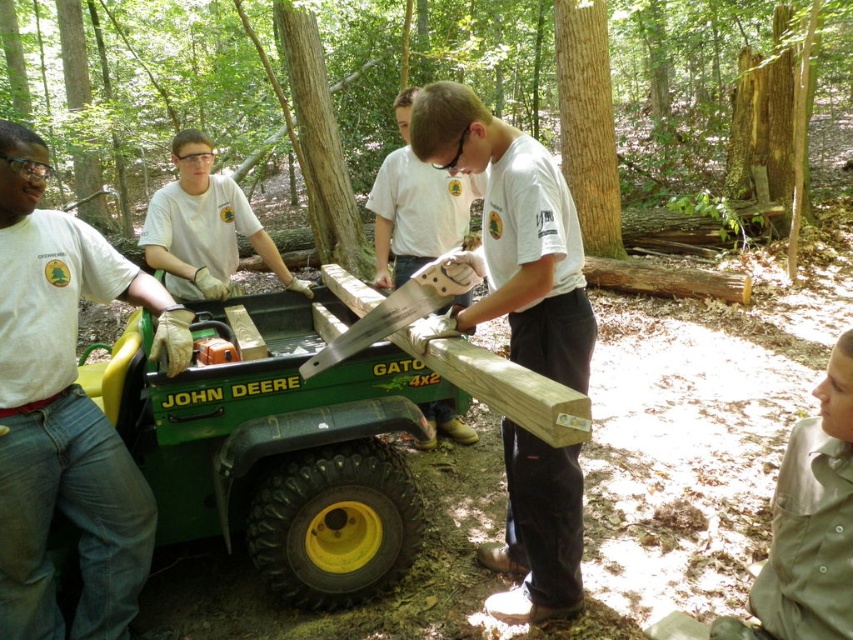
Is natural wood log at center smaller than denim jeans at left?

No.

Who is more distant from viewer, (64,93) or (0,474)?

The point (64,93) is more distant.

Does point (73, 145) lie behind point (4, 557)?

Yes, it is behind point (4, 557).

This screenshot has width=853, height=640. I want to click on natural wood log at center, so click(138, 84).

What do you see at coordinates (138, 84) in the screenshot?
I see `natural wood log at center` at bounding box center [138, 84].

Is natural wood log at center smaller than matte white saw at center?

No, natural wood log at center is not smaller than matte white saw at center.

Describe the element at coordinates (138, 84) in the screenshot. I see `natural wood log at center` at that location.

You are a GUI agent. You are given a task and a screenshot of the screen. Output one action in this format:
    pyautogui.click(x=<x>, y=<y>)
    Task: Click on the natural wood log at center
    The image size is (853, 640).
    Given the screenshot: What is the action you would take?
    pyautogui.click(x=138, y=84)

Does point (199, 275) lie in front of point (440, 205)?

Yes, point (199, 275) is closer to viewer.

How distant is white matte shirt at upper center from matte white saw at center?

A distance of 33.23 inches exists between white matte shirt at upper center and matte white saw at center.

The width and height of the screenshot is (853, 640). Identify the location of white matte shirt at upper center. point(204,227).

Find the location of `white matte shirt at upper center`. white matte shirt at upper center is located at coordinates (204, 227).